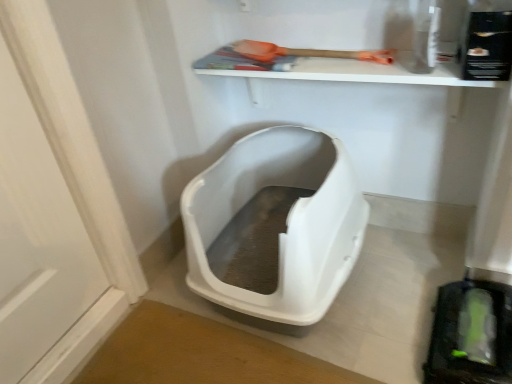
In order to face white plastic litter box at center, should I rotate leftwards or rightwards?

You should rotate right by 3.797 degrees.

The height and width of the screenshot is (384, 512). In order to click on white plastic litter box at center in this screenshot , I will do `click(286, 222)`.

Describe the element at coordinates (286, 222) in the screenshot. This screenshot has height=384, width=512. I see `white plastic litter box at center` at that location.

What do you see at coordinates (306, 52) in the screenshot? The height and width of the screenshot is (384, 512). I see `orange plastic shovel at upper center` at bounding box center [306, 52].

Measure the distance between point (302,53) and camera.

3.88 feet.

Find the location of `orange plastic shovel at upper center`. orange plastic shovel at upper center is located at coordinates (306, 52).

The width and height of the screenshot is (512, 384). Identify the location of white plastic litter box at center. (286, 222).

Which is more to the right, white plastic litter box at center or orange plastic shovel at upper center?

orange plastic shovel at upper center is more to the right.

Is white plastic litter box at center further to the viewer compared to orange plastic shovel at upper center?

No, white plastic litter box at center is closer to the viewer.

Which is closer to the camera, (199, 262) or (243, 53)?

Point (199, 262) appears to be closer to the viewer than point (243, 53).

From the image's perspective, is white plastic litter box at center beneath orange plastic shovel at upper center?

Yes.

From a real-world perspective, is white plastic litter box at center above or below orange plastic shovel at upper center?

Clearly, from a real-world perspective, white plastic litter box at center is below orange plastic shovel at upper center.

Does white plastic litter box at center have a lesser width compared to orange plastic shovel at upper center?

In fact, white plastic litter box at center might be wider than orange plastic shovel at upper center.

Between white plastic litter box at center and orange plastic shovel at upper center, which one has more height?

With more height is white plastic litter box at center.

Considering the relative sizes of white plastic litter box at center and orange plastic shovel at upper center in the image provided, is white plastic litter box at center smaller than orange plastic shovel at upper center?

Incorrect, white plastic litter box at center is not smaller in size than orange plastic shovel at upper center.

Is white plastic litter box at center outside of orange plastic shovel at upper center?

white plastic litter box at center is positioned outside orange plastic shovel at upper center.

Is white plastic litter box at center with orange plastic shovel at upper center?

No, white plastic litter box at center is not with orange plastic shovel at upper center.

In the scene shown: Is white plastic litter box at center looking in the opposite direction of orange plastic shovel at upper center?

white plastic litter box at center does not have its back to orange plastic shovel at upper center.

How distant is white plastic litter box at center from orange plastic shovel at upper center?

white plastic litter box at center is 16.22 inches away from orange plastic shovel at upper center.

I want to click on toilet that is below the orange plastic shovel at upper center (from the image's perspective), so click(x=286, y=222).

Does orange plastic shovel at upper center appear on the left side of white plastic litter box at center?

No, orange plastic shovel at upper center is not to the left of white plastic litter box at center.

Looking at this image, which object is more forward, orange plastic shovel at upper center or white plastic litter box at center?

white plastic litter box at center is in front.

Which is in front, point (344, 57) or point (355, 183)?

The point (344, 57) is in front.

From the image's perspective, which is above, orange plastic shovel at upper center or white plastic litter box at center?

orange plastic shovel at upper center.

From a real-world perspective, is orange plastic shovel at upper center under white plastic litter box at center?

Incorrect, from a real-world perspective, orange plastic shovel at upper center is higher than white plastic litter box at center.

Which object is wider, orange plastic shovel at upper center or white plastic litter box at center?

With larger width is white plastic litter box at center.

Does orange plastic shovel at upper center have a lesser height compared to white plastic litter box at center?

Indeed, orange plastic shovel at upper center has a lesser height compared to white plastic litter box at center.

Can you confirm if orange plastic shovel at upper center is bigger than white plastic litter box at center?

No, orange plastic shovel at upper center is not bigger than white plastic litter box at center.

Which is correct: orange plastic shovel at upper center is inside white plastic litter box at center, or outside of it?

orange plastic shovel at upper center is not inside white plastic litter box at center, it's outside.

Is orange plastic shovel at upper center far away from white plastic litter box at center?

Actually, orange plastic shovel at upper center and white plastic litter box at center are a little close together.

Is orange plastic shovel at upper center oriented towards white plastic litter box at center?

No, orange plastic shovel at upper center is not turned towards white plastic litter box at center.

Can you tell me how much orange plastic shovel at upper center and white plastic litter box at center differ in facing direction?

There is a 1.73-degree angle between the facing directions of orange plastic shovel at upper center and white plastic litter box at center.

How distant is orange plastic shovel at upper center from white plastic litter box at center?

orange plastic shovel at upper center is 16.22 inches away from white plastic litter box at center.

Locate an element on the screen. The image size is (512, 384). toilet on the left of orange plastic shovel at upper center is located at coordinates (286, 222).

Where is `tool above the white plastic litter box at center (from the image's perspective)`? tool above the white plastic litter box at center (from the image's perspective) is located at coordinates (306, 52).

Where is `toilet lying on the left of orange plastic shovel at upper center`? toilet lying on the left of orange plastic shovel at upper center is located at coordinates (286, 222).